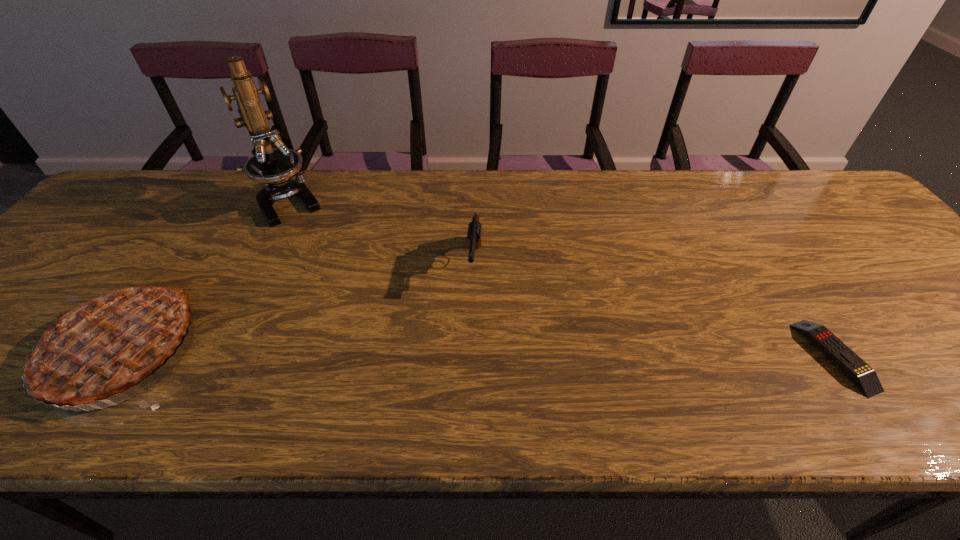
Image resolution: width=960 pixels, height=540 pixels. Find the location of `vacant region between the shortest object and the third nearest object`. vacant region between the shortest object and the third nearest object is located at coordinates (655, 310).

Locate an element on the screen. free spot between the second farthest object and the tallest object is located at coordinates (382, 233).

This screenshot has height=540, width=960. What are the coordinates of `empty space that is in between the rightmost object and the farthest object` in the screenshot? It's located at (562, 279).

This screenshot has height=540, width=960. I want to click on free spot between the tallest object and the remote control, so click(562, 279).

The height and width of the screenshot is (540, 960). In order to click on object that stands as the closest to the shortest object in this screenshot , I will do `click(474, 228)`.

Identify which object is located as the nearest to the tallest object. Please provide its 2D coordinates. Your answer should be formatted as a tuple, i.e. [(x, y)], where the tuple contains the x and y coordinates of a point satisfying the conditions above.

[(96, 342)]

Identify the location of vacant space that satisfies the following two spatial constraints: 1. on the front side of the third tallest object; 2. on the right side of the tallest object. (258, 265).